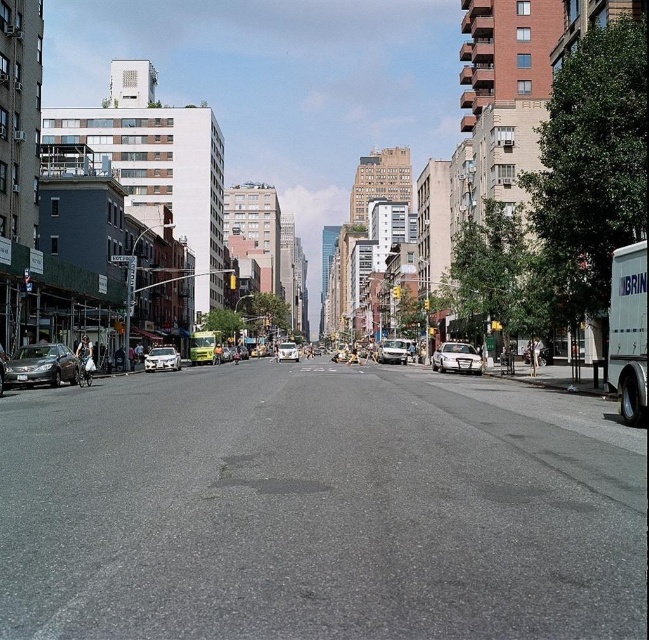
Question: Which point is farther to the camera?

Choices:
 (A) (297, 349)
 (B) (56, 349)
 (C) (171, 358)

Answer: (A)

Question: Which point is closer to the camera?

Choices:
 (A) (177, 364)
 (B) (284, 346)
 (C) (476, 362)
 (D) (67, 360)

Answer: (D)

Question: From the image, what is the correct spatial relationship of shiny silver sedan at left in relation to white glossy car at center?

Choices:
 (A) below
 (B) above

Answer: (B)

Question: Does white glossy sedan at center appear on the right side of silver metallic sedan at center?

Choices:
 (A) yes
 (B) no

Answer: (B)

Question: Which is farther from the white glossy car at center?

Choices:
 (A) white glossy sedan at center
 (B) shiny silver car at center

Answer: (B)

Question: Does white glossy sedan at center appear over shiny silver car at center?

Choices:
 (A) no
 (B) yes

Answer: (B)